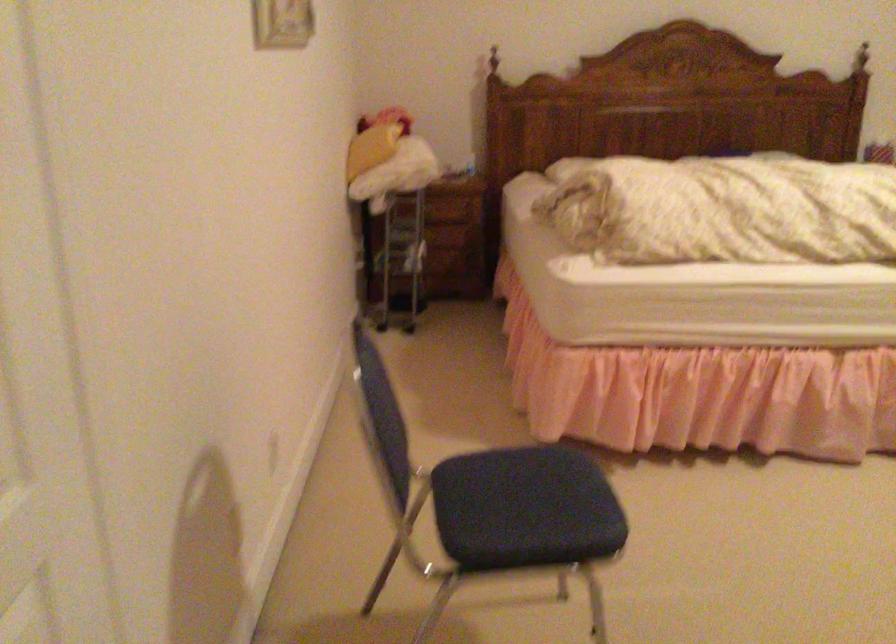
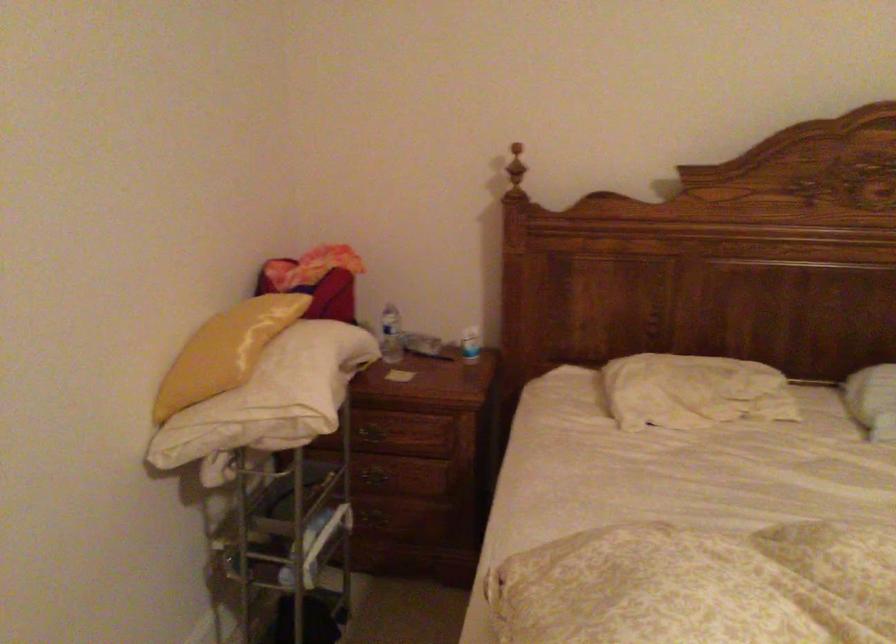
Locate, in the second image, the point that corresponds to the point at 464,154 in the first image.

(470, 344)